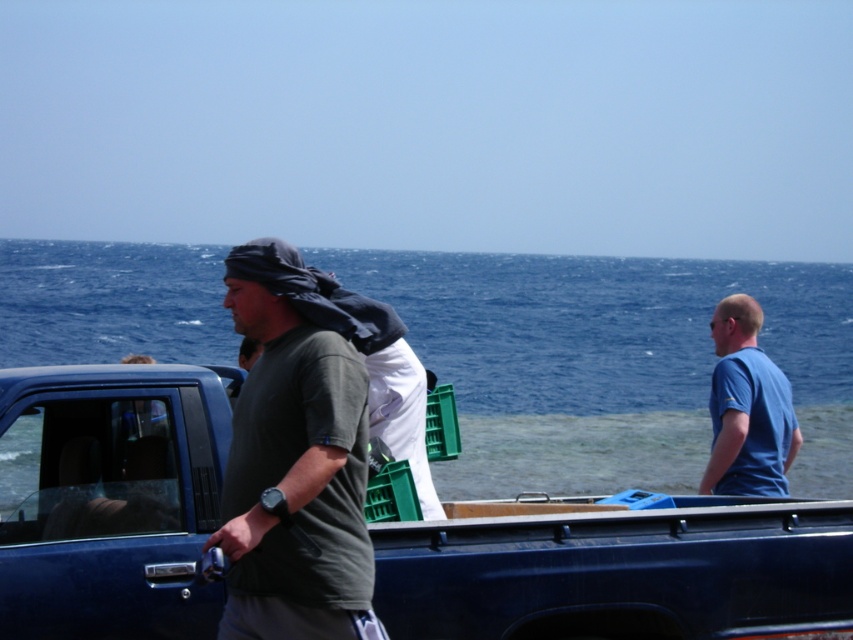
Question: Which of these objects is positioned closest to the blue matte shirt at right?

Choices:
 (A) dark green fabric truck at center
 (B) blue water at center

Answer: (A)

Question: Can you confirm if dark green fabric truck at center is bigger than blue matte shirt at right?

Choices:
 (A) yes
 (B) no

Answer: (B)

Question: Among these objects, which one is farthest from the camera?

Choices:
 (A) blue matte shirt at right
 (B) blue water at center
 (C) dark green fabric truck at center

Answer: (A)

Question: Which point appears farthest from the camera in this image?

Choices:
 (A) (271, 412)
 (B) (735, 444)
 (C) (47, 321)

Answer: (C)

Question: Is dark green fabric truck at center closer to the viewer compared to blue matte shirt at right?

Choices:
 (A) no
 (B) yes

Answer: (B)

Question: From the image, what is the correct spatial relationship of blue water at center in relation to blue matte shirt at right?

Choices:
 (A) right
 (B) left

Answer: (B)